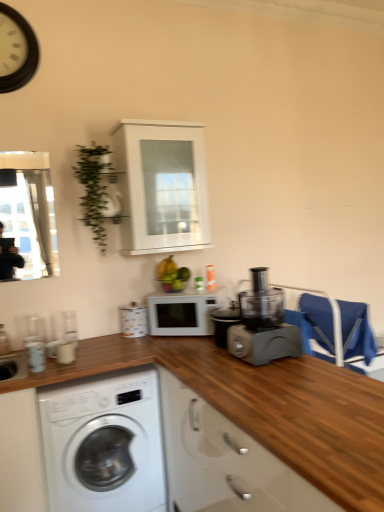
Question: Can you confirm if blue fabric chair at right is thinner than white glossy canister at upper center, the first appliance positioned from the right?

Choices:
 (A) no
 (B) yes

Answer: (A)

Question: Considering the relative sizes of blue fabric chair at right and white glossy canister at upper center, the 2th appliance when ordered from front to back, in the image provided, is blue fabric chair at right bigger than white glossy canister at upper center, the 2th appliance when ordered from front to back,?

Choices:
 (A) yes
 (B) no

Answer: (A)

Question: Does blue fabric chair at right appear on the left side of white glossy canister at upper center, which ranks as the 1th appliance in back-to-front order?

Choices:
 (A) yes
 (B) no

Answer: (B)

Question: Does blue fabric chair at right appear on the right side of white glossy canister at upper center, which ranks as the 1th appliance in back-to-front order?

Choices:
 (A) yes
 (B) no

Answer: (A)

Question: Is blue fabric chair at right turned away from white glossy canister at upper center, which is the 2th appliance in left-to-right order?

Choices:
 (A) no
 (B) yes

Answer: (B)

Question: Is green matte bananas at center situated inside blue fabric chair at right or outside?

Choices:
 (A) inside
 (B) outside

Answer: (B)

Question: Would you say green matte bananas at center is to the left or to the right of blue fabric chair at right in the picture?

Choices:
 (A) right
 (B) left

Answer: (B)

Question: From their relative heights in the image, would you say green matte bananas at center is taller or shorter than blue fabric chair at right?

Choices:
 (A) short
 (B) tall

Answer: (A)

Question: From a real-world perspective, is green matte bananas at center physically located above or below blue fabric chair at right?

Choices:
 (A) above
 (B) below

Answer: (A)

Question: From a real-world perspective, is white wooden clock at upper left positioned above or below blue fabric chair at right?

Choices:
 (A) below
 (B) above

Answer: (B)

Question: Does point coord(13,84) appear closer or farther from the camera than point coord(332,339)?

Choices:
 (A) farther
 (B) closer

Answer: (B)

Question: Considering the relative positions of white wooden clock at upper left and blue fabric chair at right in the image provided, is white wooden clock at upper left to the left or to the right of blue fabric chair at right?

Choices:
 (A) left
 (B) right

Answer: (A)

Question: From the image's perspective, is white wooden clock at upper left above or below blue fabric chair at right?

Choices:
 (A) above
 (B) below

Answer: (A)

Question: Is blue fabric chair at right wider or thinner than white glossy washing machine at lower left?

Choices:
 (A) thin
 (B) wide

Answer: (A)

Question: Would you say blue fabric chair at right is to the left or to the right of white glossy washing machine at lower left in the picture?

Choices:
 (A) right
 (B) left

Answer: (A)